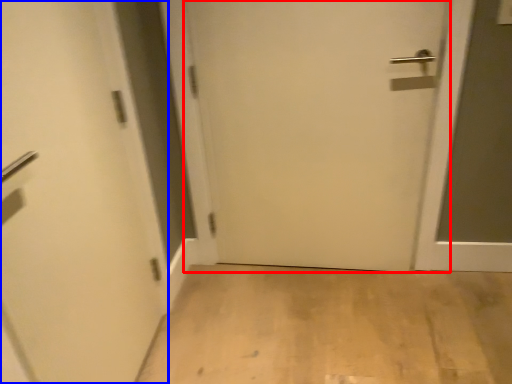
Question: Which of the following is the farthest to the observer, door (highlighted by a red box) or door (highlighted by a blue box)?

Choices:
 (A) door
 (B) door

Answer: (A)